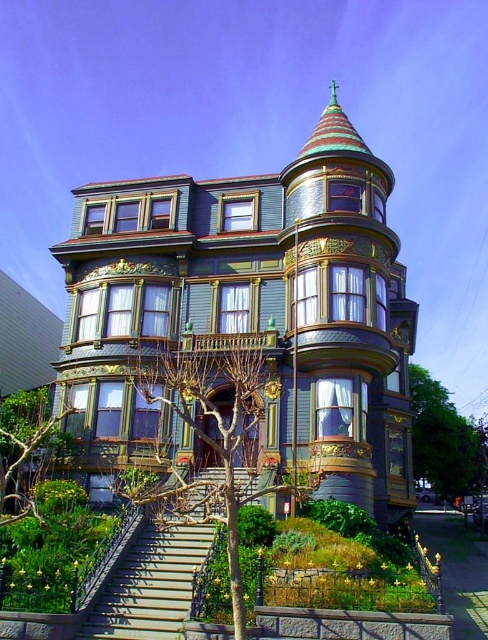
Question: Which point appears farthest from the camera in this image?

Choices:
 (A) (210, 449)
 (B) (16, 483)

Answer: (A)

Question: Which object appears farthest from the camera in this image?

Choices:
 (A) green leafy tree at lower left
 (B) green leafy tree at lower right
 (C) bare branches at center

Answer: (B)

Question: Does bare branches at center appear on the right side of green leafy tree at lower left?

Choices:
 (A) no
 (B) yes

Answer: (B)

Question: Which object appears farthest from the camera in this image?

Choices:
 (A) green leafy tree at lower left
 (B) bare branches at center
 (C) green leafy tree at lower right

Answer: (C)

Question: Is bare branches at center smaller than green leafy tree at lower left?

Choices:
 (A) no
 (B) yes

Answer: (A)

Question: Is bare branches at center behind green leafy tree at lower right?

Choices:
 (A) yes
 (B) no

Answer: (B)